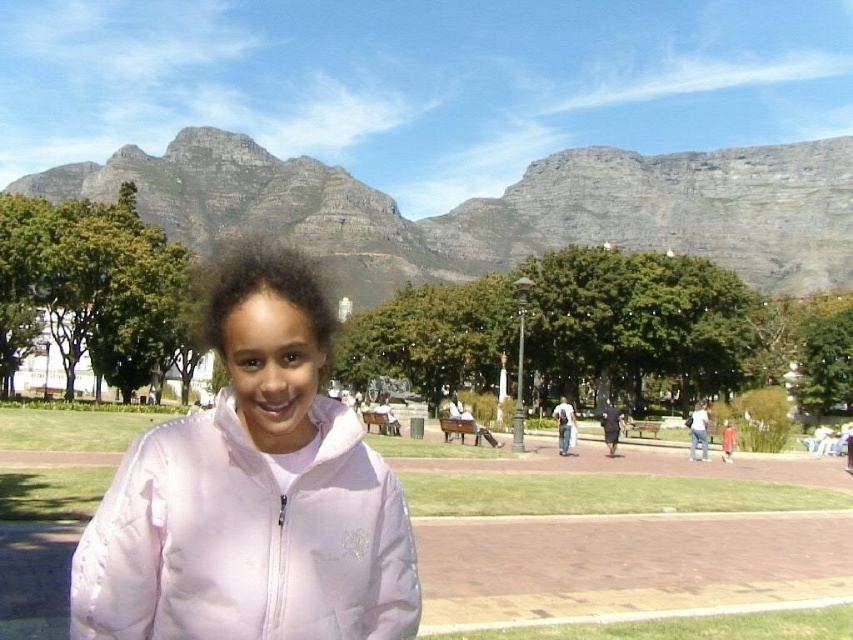
Consider the image. Does pink quilted jacket at center have a smaller size compared to rocky gray mountain at upper center?

Yes.

Is point (363, 608) less distant than point (827, 205)?

Yes.

At what (x,y) coordinates should I click in order to perform the action: click on pink quilted jacket at center. Please return your answer as a coordinate pair (x, y). Looking at the image, I should click on (252, 493).